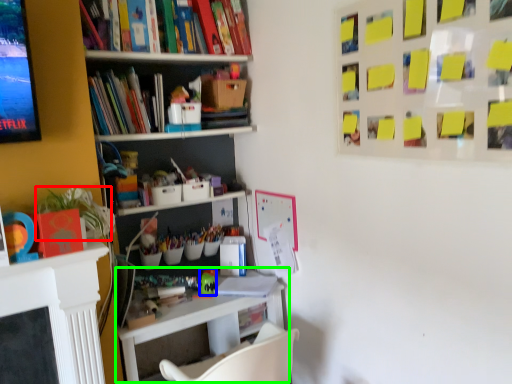
Question: Estimate the real-world distances between objects in this image. Which object is farther from plant (highlighted by a red box), toy (highlighted by a blue box) or table (highlighted by a green box)?

Choices:
 (A) toy
 (B) table

Answer: (A)